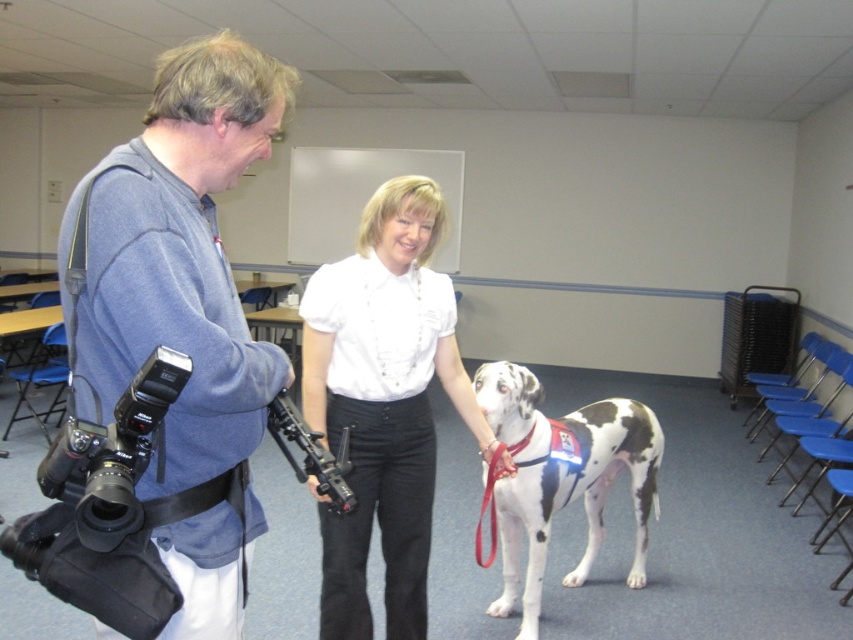
Question: Which of the following is the farthest from the observer?

Choices:
 (A) spotted fur dog at center
 (B) white smooth shirt at center
 (C) matte blue jacket at left

Answer: (A)

Question: Does matte blue jacket at left lie behind white smooth shirt at center?

Choices:
 (A) no
 (B) yes

Answer: (A)

Question: Among these points, which one is farthest from the camera?

Choices:
 (A) (531, 600)
 (B) (432, 228)

Answer: (A)

Question: From the image, what is the correct spatial relationship of matte blue jacket at left in relation to spotted fur dog at center?

Choices:
 (A) right
 (B) left

Answer: (B)

Question: Is matte blue jacket at left closer to the viewer compared to white smooth shirt at center?

Choices:
 (A) no
 (B) yes

Answer: (B)

Question: Which of the following is the closest to the observer?

Choices:
 (A) (491, 611)
 (B) (404, 204)

Answer: (B)